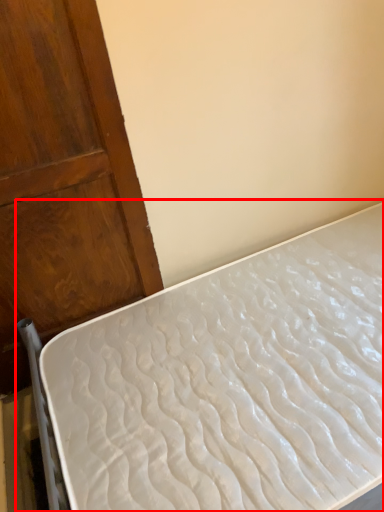
Question: Where is bed (annotated by the red box) located in relation to door in the image?

Choices:
 (A) right
 (B) left

Answer: (A)